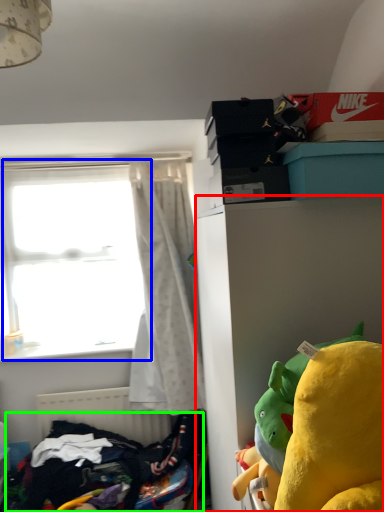
Question: Which object is the closest to the cabinetry (highlighted by a red box)? Choose among these: window (highlighted by a blue box) or clothing (highlighted by a green box).

Choices:
 (A) window
 (B) clothing

Answer: (B)